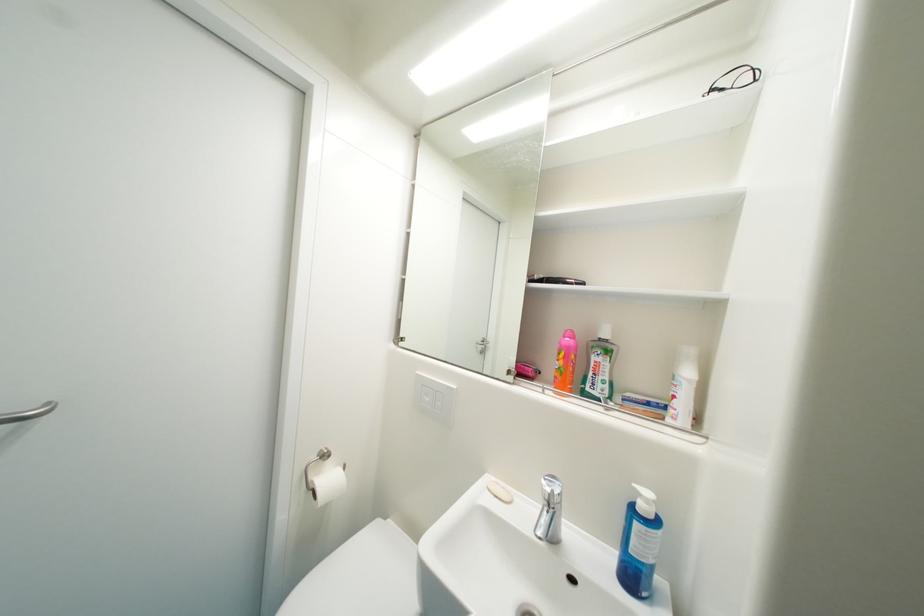
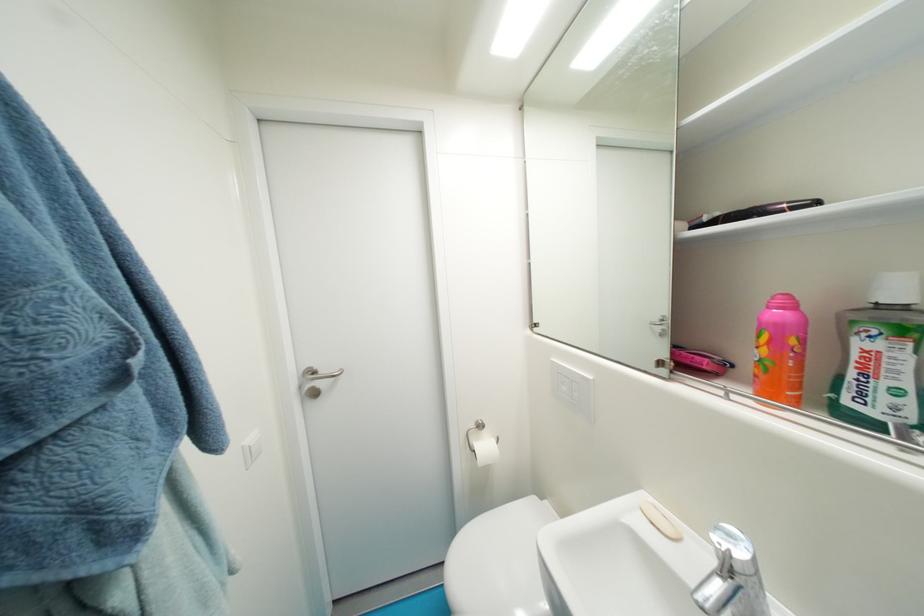
The point at (337, 482) is marked in the first image. Where is the corresponding point in the second image?

(492, 448)